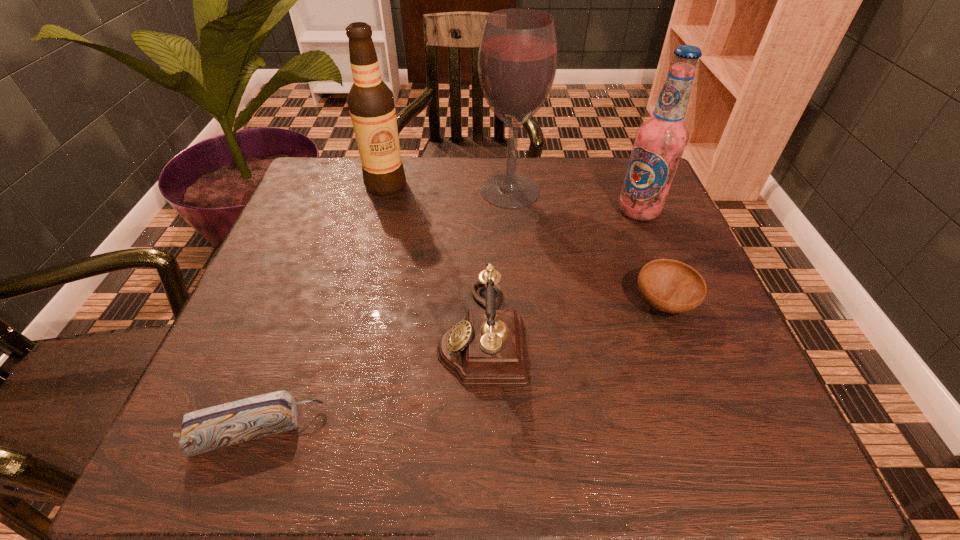
Locate an element on the screen. free space that satisfies the following two spatial constraints: 1. on the label of the leftmost alcohol; 2. on the left side of the second alcohol from left to right is located at coordinates (385, 191).

The image size is (960, 540). I want to click on blank area in the image that satisfies the following two spatial constraints: 1. on the label of the second alcohol from right to left; 2. on the left side of the leftmost alcohol, so click(x=385, y=191).

At what (x,y) coordinates should I click in order to perform the action: click on free spot that satisfies the following two spatial constraints: 1. on the label of the leftmost alcohol; 2. on the right side of the rightmost alcohol. Please return your answer as a coordinate pair (x, y). The width and height of the screenshot is (960, 540). Looking at the image, I should click on (379, 211).

This screenshot has height=540, width=960. In order to click on vacant space that satisfies the following two spatial constraints: 1. on the back side of the nearest object; 2. on the left side of the bowl in this screenshot , I will do `click(302, 303)`.

At what (x,y) coordinates should I click in order to perform the action: click on vacant position in the image that satisfies the following two spatial constraints: 1. on the label of the leftmost alcohol; 2. on the left side of the second alcohol from left to right. Please return your answer as a coordinate pair (x, y). The width and height of the screenshot is (960, 540). Looking at the image, I should click on (385, 191).